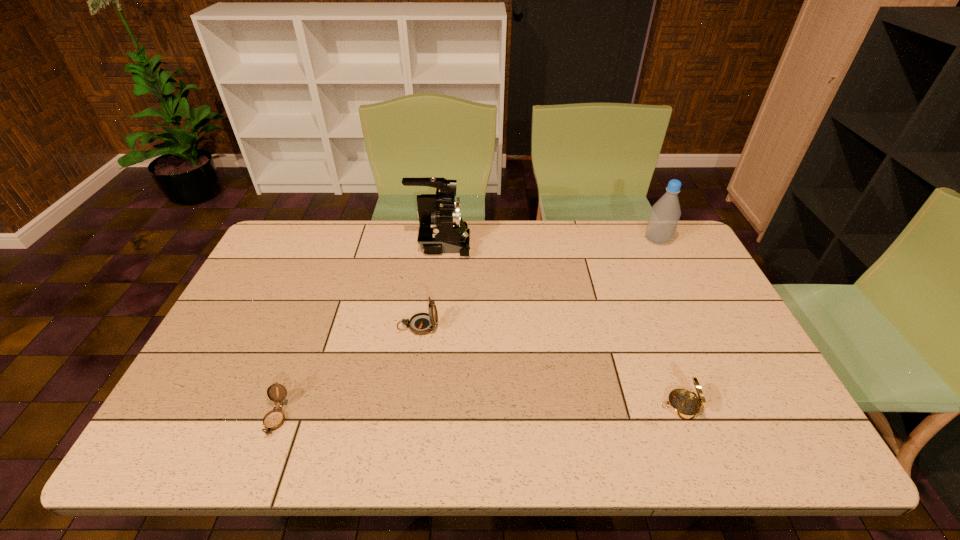
The height and width of the screenshot is (540, 960). What are the coordinates of `empty space that is in between the second shortest object and the rightmost object` in the screenshot? It's located at (669, 323).

Image resolution: width=960 pixels, height=540 pixels. I want to click on vacant area between the camcorder and the third nearest object, so click(x=429, y=285).

I want to click on vacant point located between the rightmost compass and the leftmost object, so click(x=478, y=412).

This screenshot has width=960, height=540. What are the coordinates of `vacant area between the second object from right to left and the camcorder` in the screenshot? It's located at (561, 325).

Choose which object is the third nearest neighbor to the bottle. Please provide its 2D coordinates. Your answer should be formatted as a tuple, i.e. [(x, y)], where the tuple contains the x and y coordinates of a point satisfying the conditions above.

[(422, 323)]

The image size is (960, 540). Find the location of `object that can be found as the closest to the farthest compass`. object that can be found as the closest to the farthest compass is located at coordinates pyautogui.click(x=442, y=230).

Identify the location of compass that stands as the second closest to the bottle. The image size is (960, 540). (422, 323).

You are a GUI agent. You are given a task and a screenshot of the screen. Output one action in this format:
    pyautogui.click(x=<x>, y=<y>)
    Task: Click on the compass that is the second closest to the bottle
    
    Given the screenshot: What is the action you would take?
    pyautogui.click(x=422, y=323)

This screenshot has height=540, width=960. In order to click on free space that satisfies the following two spatial constraints: 1. on the front side of the rightmost object; 2. on the lens mount of the camcorder in this screenshot , I will do `click(659, 244)`.

The height and width of the screenshot is (540, 960). Identify the location of vacant area that satisfies the following two spatial constraints: 1. on the face of the third nearest object; 2. on the face of the shortest compass. (405, 418).